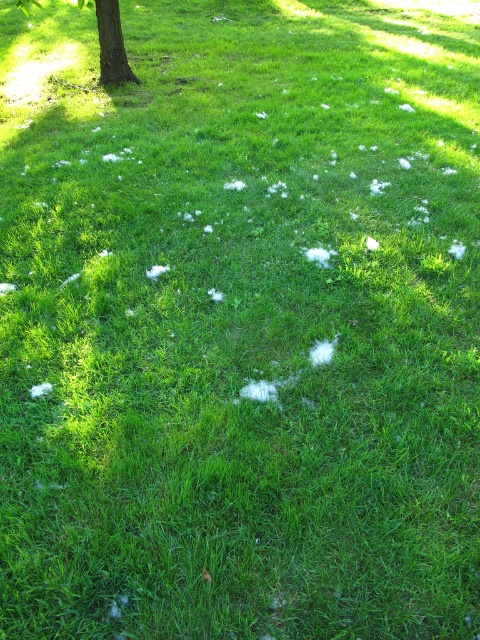
Question: Is brown textured tree at upper left positioned in front of brown rough bark at upper left?

Choices:
 (A) yes
 (B) no

Answer: (B)

Question: Is brown textured tree at upper left below brown rough bark at upper left?

Choices:
 (A) no
 (B) yes

Answer: (B)

Question: Which of the following is the closest to the observer?

Choices:
 (A) (100, 22)
 (B) (109, 74)

Answer: (A)

Question: Which of the following is the closest to the observer?

Choices:
 (A) brown rough bark at upper left
 (B) brown textured tree at upper left

Answer: (A)

Question: Which point is closer to the camera?

Choices:
 (A) brown rough bark at upper left
 (B) brown textured tree at upper left

Answer: (A)

Question: Does brown textured tree at upper left have a greater width compared to brown rough bark at upper left?

Choices:
 (A) no
 (B) yes

Answer: (A)